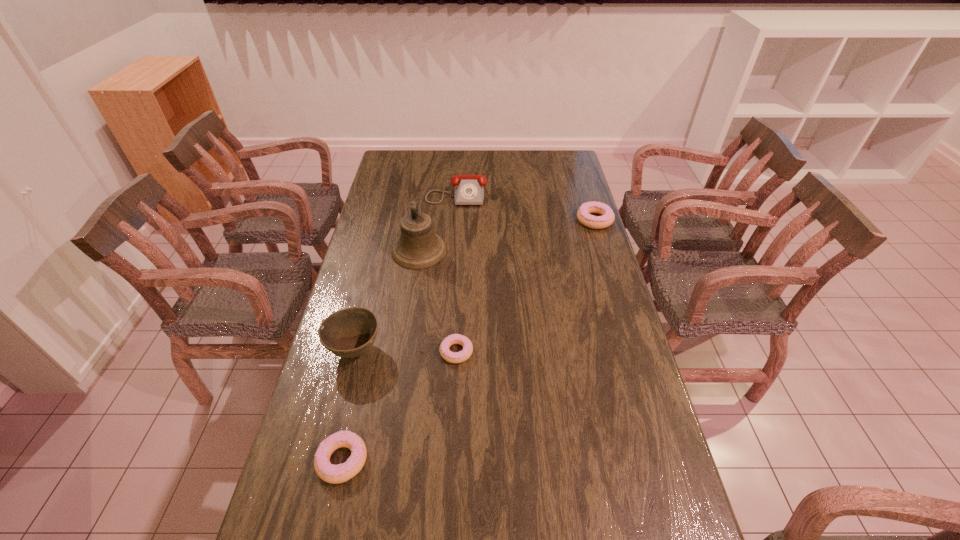
This screenshot has height=540, width=960. In order to click on bowl in this screenshot , I will do `click(350, 332)`.

The image size is (960, 540). I want to click on blank area located 0.300m on the back of the nearest object, so click(369, 342).

Image resolution: width=960 pixels, height=540 pixels. What are the coordinates of `free space located 0.400m on the right of the shortest object` in the screenshot? It's located at (607, 352).

Where is `vacant space located 0.100m on the front of the farthest doughnut`? vacant space located 0.100m on the front of the farthest doughnut is located at coordinates (603, 248).

The image size is (960, 540). Identify the location of free space located 0.290m on the back of the third farthest object. (428, 192).

In order to click on free space located 0.300m on the dial of the telephone in this screenshot , I will do [452, 253].

This screenshot has width=960, height=540. I want to click on vacant area situated 0.150m on the right of the bowl, so click(433, 350).

Where is `doughnut positioned at the left edge`? This screenshot has width=960, height=540. doughnut positioned at the left edge is located at coordinates (335, 474).

Where is `bell that is at the left edge`? This screenshot has width=960, height=540. bell that is at the left edge is located at coordinates (418, 247).

Where is `bowl situated at the left edge`? bowl situated at the left edge is located at coordinates (350, 332).